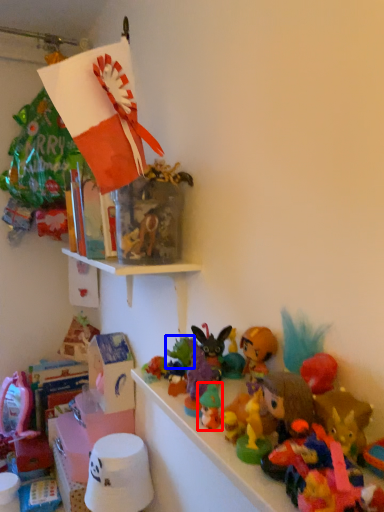
Question: Which of the following is the farthest to the observer, toy (highlighted by a red box) or toy (highlighted by a blue box)?

Choices:
 (A) toy
 (B) toy

Answer: (B)